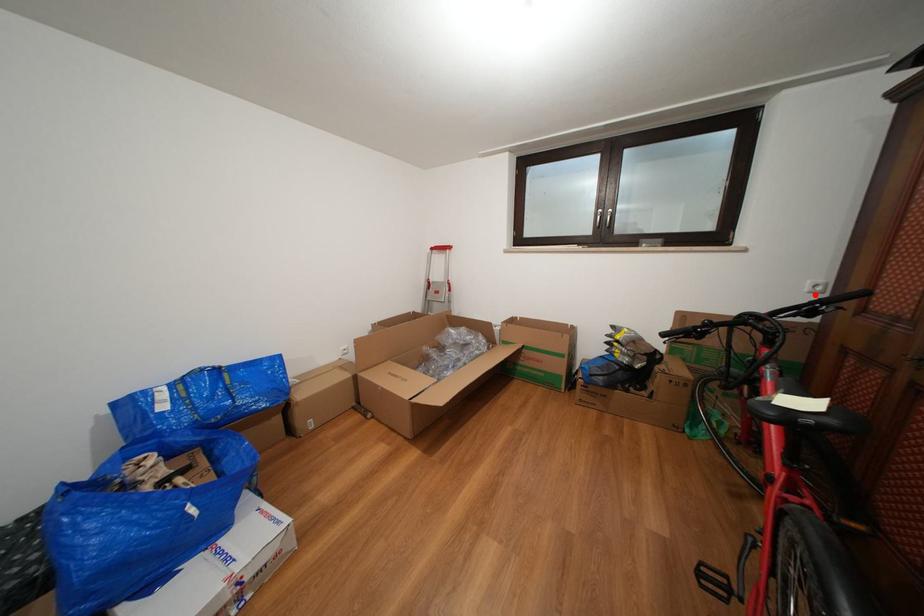
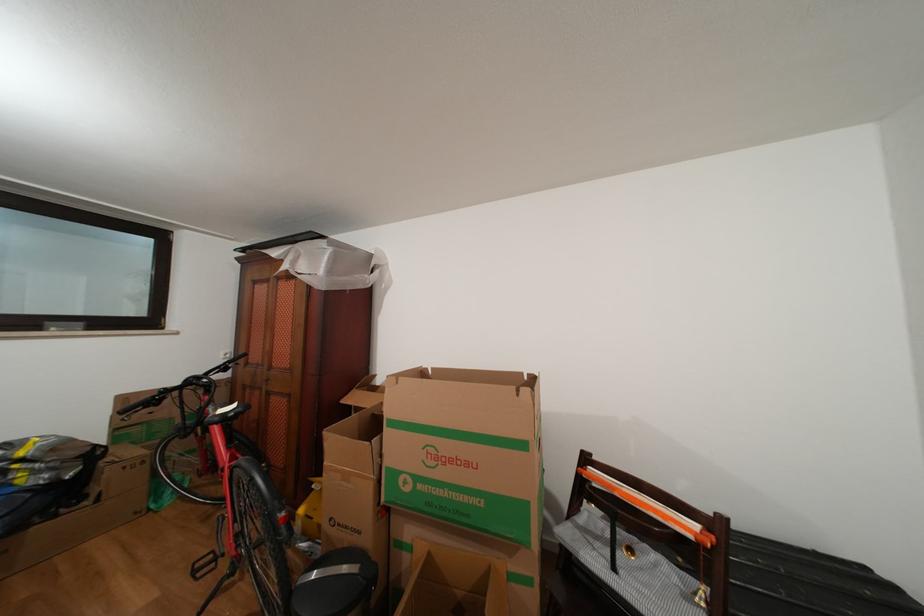
Locate, in the second image, the point that corresponds to the highlighted location in the first image.

(229, 363)